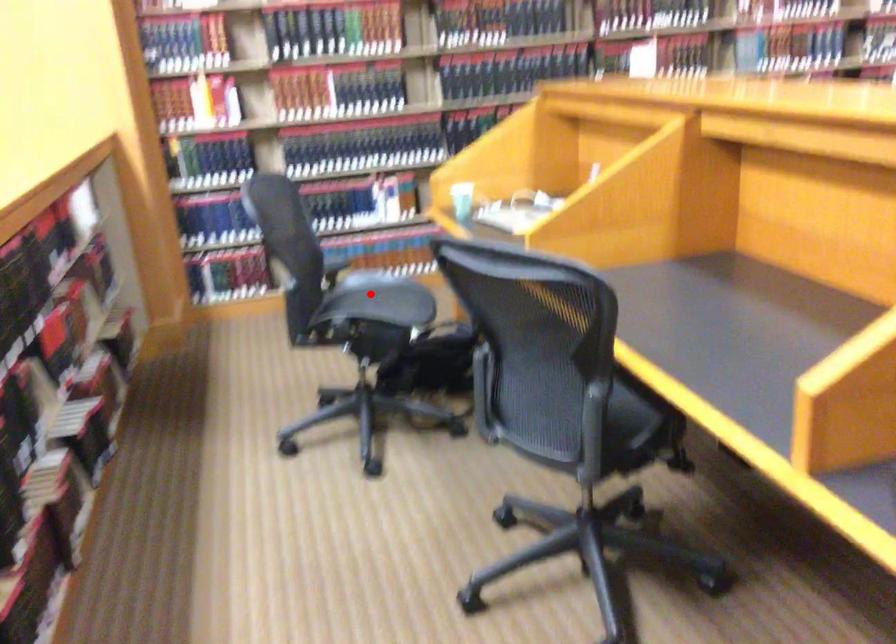
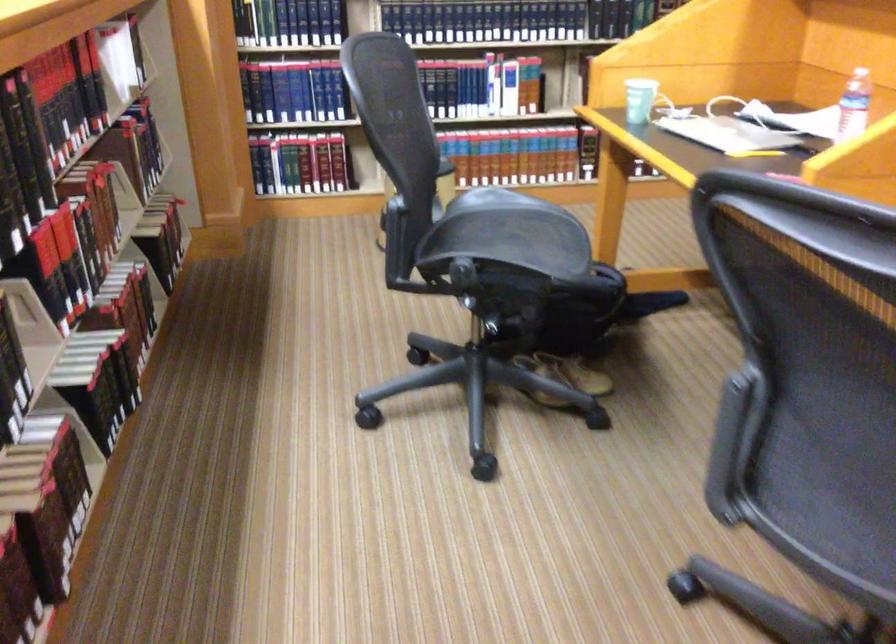
Question: I am providing you with two images of the same scene from different viewpoints. In image1, a red point is highlighted. Considering the same 3D point in image2, which of the following is correct?

Choices:
 (A) It is closer
 (B) It is farther

Answer: (A)